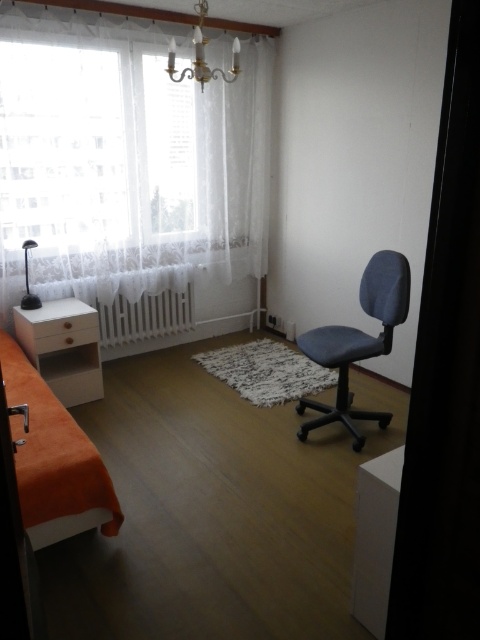
Does white plastic radiator at center have a smaller size compared to gold metallic chandelier at upper center?

Yes.

Who is taller, white plastic radiator at center or gold metallic chandelier at upper center?

With more height is gold metallic chandelier at upper center.

Is point (155, 323) positioned behind point (172, 67)?

Yes, point (155, 323) is behind point (172, 67).

This screenshot has width=480, height=640. I want to click on white plastic radiator at center, so click(x=144, y=316).

Does white lace curtain at upper left appear on the right side of orange fabric bed at lower left?

Indeed, white lace curtain at upper left is positioned on the right side of orange fabric bed at lower left.

Is the position of white lace curtain at upper left more distant than that of orange fabric bed at lower left?

Yes, it is.

Where is `white lace curtain at upper left`? white lace curtain at upper left is located at coordinates (126, 160).

This screenshot has height=640, width=480. What are the coordinates of `white lace curtain at upper left` in the screenshot? It's located at (126, 160).

Does white lace curtain at upper left have a lesser width compared to black plastic lamp at left?

In fact, white lace curtain at upper left might be wider than black plastic lamp at left.

Between point (213, 157) and point (36, 307), which one is positioned in front?

Point (36, 307) is more forward.

The width and height of the screenshot is (480, 640). I want to click on white lace curtain at upper left, so click(126, 160).